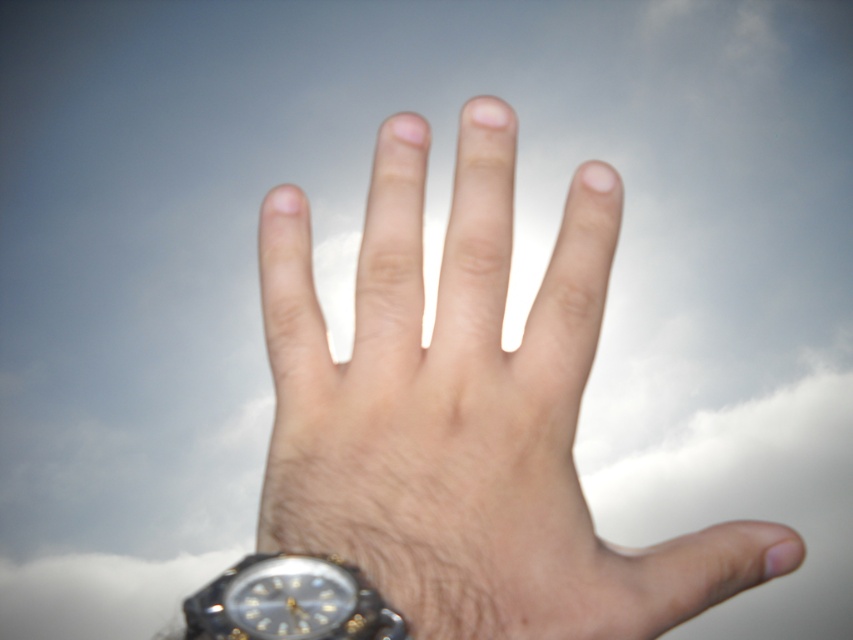
You are a jeweler examining a customer who wants to place a new bracelet on their wrist. The customer has a smooth skin hand at center and a black plastic watch at lower left. Which object would you measure first to ensure the bracelet fits properly?

You should measure the smooth skin hand at center first because it is larger than the black plastic watch at lower left, ensuring the bracelet accommodates the hand size before considering the watch.

You are a designer creating a poster and need to know the relative sizes of the objects in the image. Based on the scene, which object is taller between the smooth skin hand at center and the black plastic watch at lower left?

The smooth skin hand at center is taller than the black plastic watch at lower left according to the description.